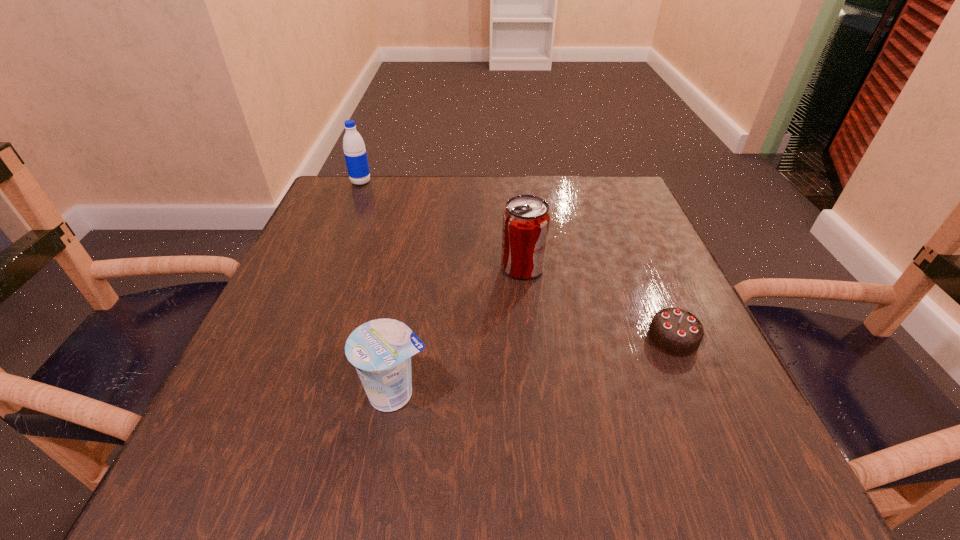
Where is `blank region between the farthest object and the yogurt`? The width and height of the screenshot is (960, 540). blank region between the farthest object and the yogurt is located at coordinates (378, 288).

Locate an element on the screen. This screenshot has height=540, width=960. object that is the second closest one to the third object from right to left is located at coordinates (674, 331).

Identify which object is the second closest to the farthest object. Please provide its 2D coordinates. Your answer should be formatted as a tuple, i.e. [(x, y)], where the tuple contains the x and y coordinates of a point satisfying the conditions above.

[(381, 349)]

I want to click on vacant position in the image that satisfies the following two spatial constraints: 1. on the front side of the rightmost object; 2. on the left side of the water bottle, so click(x=297, y=338).